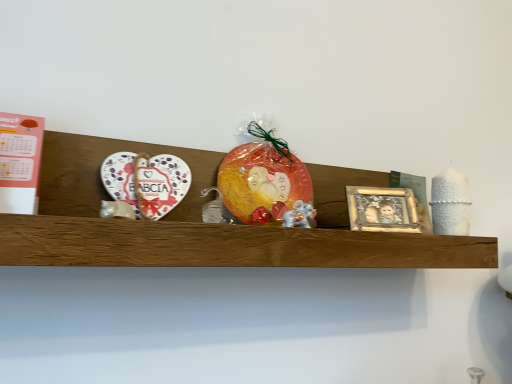
Question: Can you confirm if white ceramic heart at left is positioned to the right of wooden shelf at center?

Choices:
 (A) no
 (B) yes

Answer: (A)

Question: Could you tell me if white ceramic heart at left is facing wooden shelf at center?

Choices:
 (A) no
 (B) yes

Answer: (B)

Question: Is white ceramic heart at left wider than wooden shelf at center?

Choices:
 (A) yes
 (B) no

Answer: (B)

Question: Is the depth of white ceramic heart at left greater than that of wooden shelf at center?

Choices:
 (A) no
 (B) yes

Answer: (B)

Question: Considering the relative positions of white ceramic heart at left and wooden shelf at center in the image provided, is white ceramic heart at left in front of wooden shelf at center?

Choices:
 (A) yes
 (B) no

Answer: (B)

Question: Is translucent plastic bag at center bigger or smaller than white glossy mouse at center?

Choices:
 (A) small
 (B) big

Answer: (B)

Question: Considering the positions of translucent plastic bag at center and white glossy mouse at center in the image, is translucent plastic bag at center wider or thinner than white glossy mouse at center?

Choices:
 (A) wide
 (B) thin

Answer: (A)

Question: Does point (288, 155) appear closer or farther from the camera than point (293, 208)?

Choices:
 (A) farther
 (B) closer

Answer: (A)

Question: Based on their positions, is translucent plastic bag at center located to the left or right of white glossy mouse at center?

Choices:
 (A) right
 (B) left

Answer: (B)

Question: Is white ceramic heart at left wider or thinner than wooden shelf at center?

Choices:
 (A) wide
 (B) thin

Answer: (B)

Question: Is white ceramic heart at left bigger or smaller than wooden shelf at center?

Choices:
 (A) big
 (B) small

Answer: (B)

Question: In the image, is white ceramic heart at left positioned in front of or behind wooden shelf at center?

Choices:
 (A) front
 (B) behind

Answer: (B)

Question: Is point pos(111,188) positioned closer to the camera than point pos(140,248)?

Choices:
 (A) farther
 (B) closer

Answer: (A)

Question: Does point (129, 188) appear closer or farther from the camera than point (376, 230)?

Choices:
 (A) farther
 (B) closer

Answer: (B)

Question: From the image's perspective, is white ceramic heart at left positioned above or below gold metallic picture frame at center-right?

Choices:
 (A) above
 (B) below

Answer: (A)